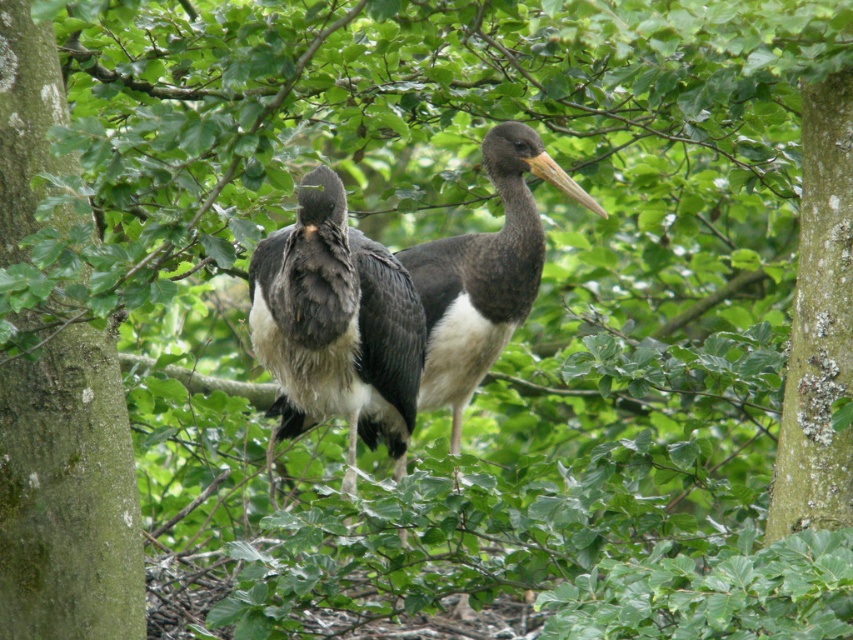
You are a birdwatcher observing the two birds in the image. You notice the dark gray feathers at center and the black glossy stork at center. Which object is positioned closer to you?

The dark gray feathers at center are closer to the viewer than the black glossy stork at center.

You are a birdwatcher observing two birds in the forest. You notice the dark gray feathers at center and the black glossy stork at center. Which object is positioned lower in the image?

The dark gray feathers at center is located below the black glossy stork at center, so the dark gray feathers at center is positioned lower in the image.

Looking at this image, you are a birdwatcher observing two birds in a forest. You notice the dark gray feathers at center and the black glossy stork at center. Which one is closer to the ground?

The dark gray feathers at center is shorter than the black glossy stork at center, so the dark gray feathers at center is closer to the ground.